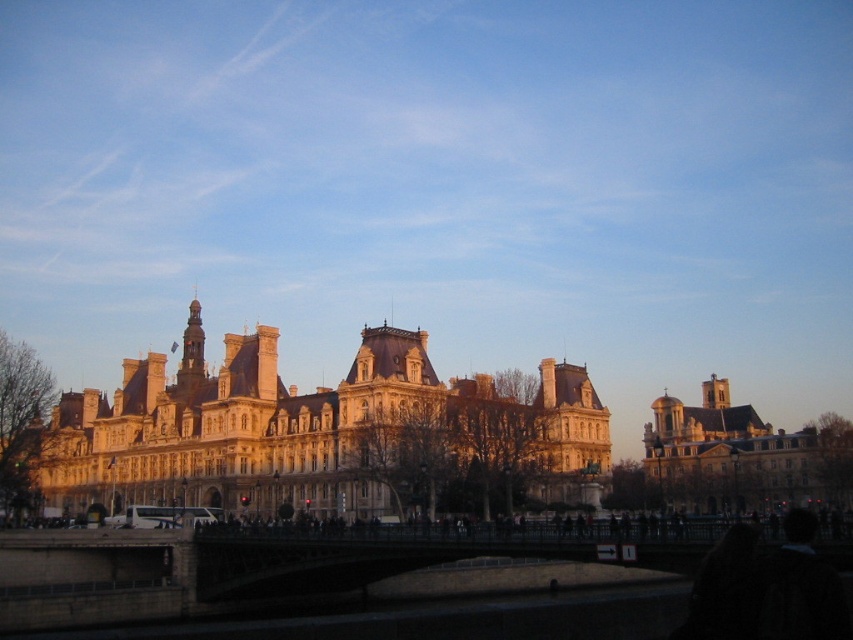
You are an architect analyzing the scene. The golden stone palace at center and the golden stone church at right are both illuminated by the late afternoon sun. Which structure has a larger footprint in terms of width when viewed from this perspective?

The golden stone palace at center has a larger footprint in terms of width compared to the golden stone church at right since its width surpasses the church.

Based on the scene description, where is the golden stone palace at center located in terms of its 2D coordinates?

The golden stone palace at center is located at the 2D coordinates of point (311, 429).

You are a tourist standing on the bridge looking towards the golden stone palace at center and the golden stone church at right. Which building is closer to you?

The golden stone palace at center is closer to you because it is in front of the golden stone church at right.